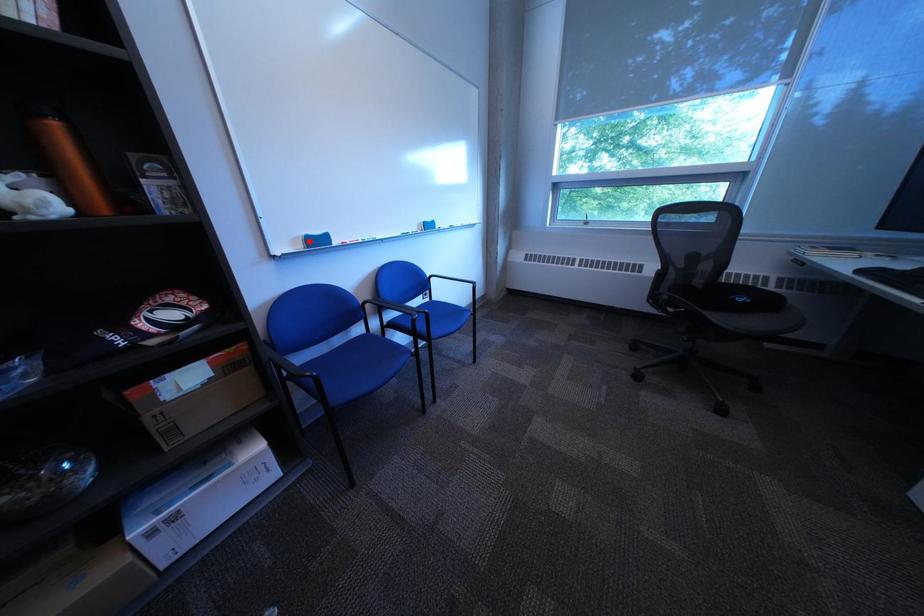
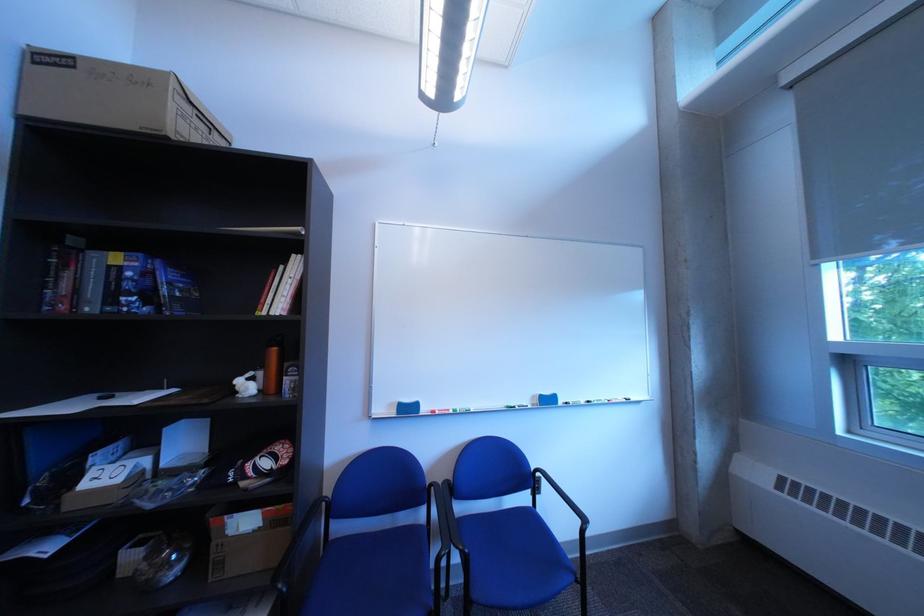
Where in the second image is the point corresponding to the highlighted location from the first image?

(406, 407)